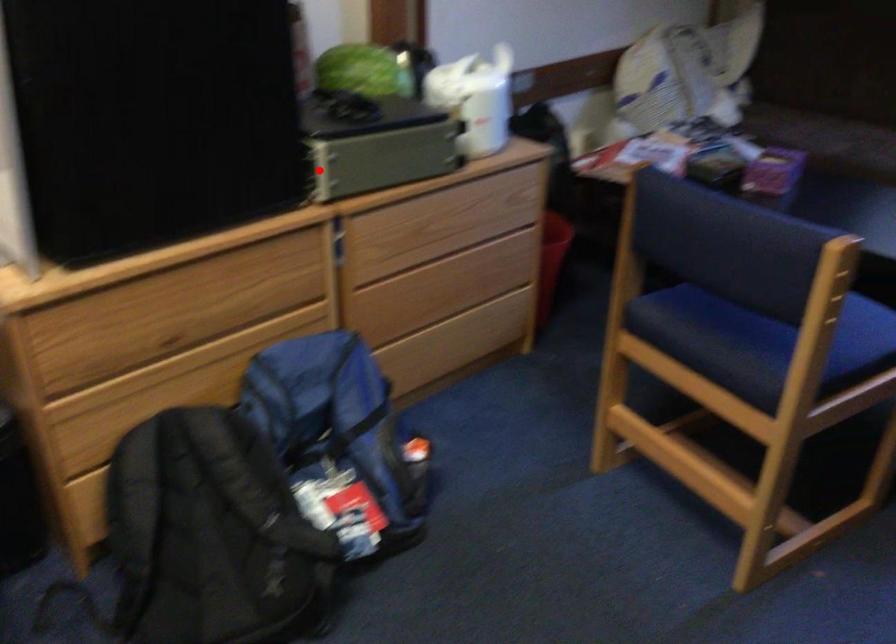
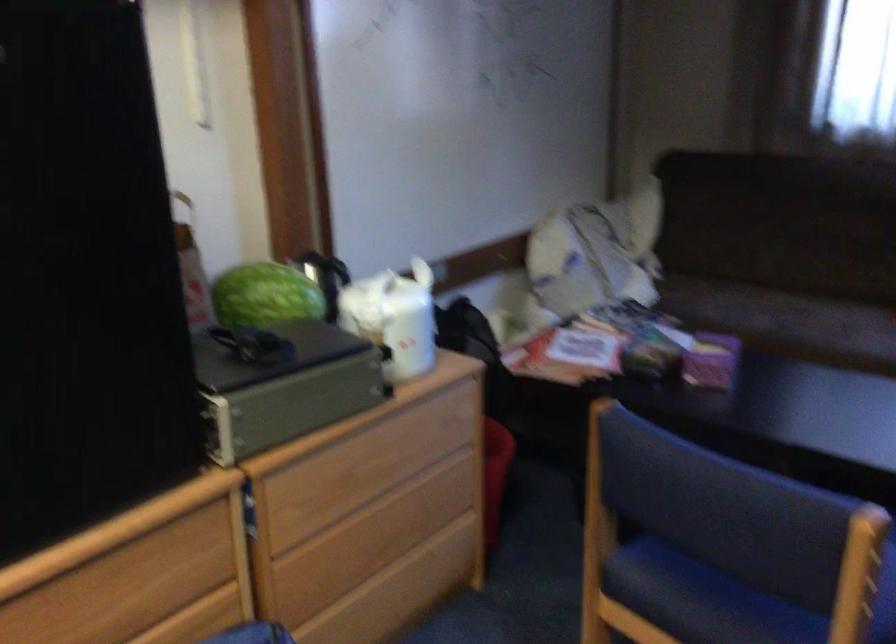
Question: A red point is marked in image1. In image2, is the corresponding 3D point closer to the camera or farther? Reply with the corresponding letter.

Choices:
 (A) The corresponding 3D point is closer.
 (B) The corresponding 3D point is farther.

Answer: (A)